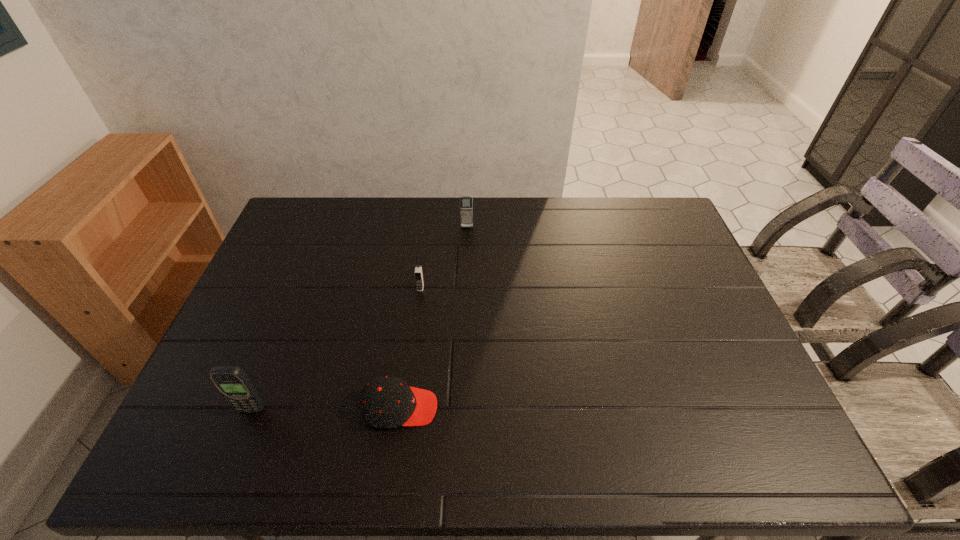
You are a GUI agent. You are given a task and a screenshot of the screen. Output one action in this format:
    pyautogui.click(x=<x>, y=<y>)
    Task: Click on the free space that is in between the leftmost object and the second nearest cellular telephone
    
    Given the screenshot: What is the action you would take?
    [336, 349]

Where is `blank region between the nearest cellular telephone and the shortest object`? The height and width of the screenshot is (540, 960). blank region between the nearest cellular telephone and the shortest object is located at coordinates (325, 408).

Where is `vacant area that lies between the nearest cellular telephone and the cap`? vacant area that lies between the nearest cellular telephone and the cap is located at coordinates (325, 408).

Image resolution: width=960 pixels, height=540 pixels. What are the coordinates of `free spot between the shortest object and the nearest cellular telephone` in the screenshot? It's located at point(325,408).

Locate an element on the screen. This screenshot has width=960, height=540. vacant area between the shortest object and the second cellular telephone from right to left is located at coordinates (410, 348).

What are the coordinates of `vacant space that is in between the rightmost object and the nearest cellular telephone` in the screenshot? It's located at (359, 319).

Where is `vacant area that lies between the rightmost cellular telephone and the second farthest cellular telephone`? The width and height of the screenshot is (960, 540). vacant area that lies between the rightmost cellular telephone and the second farthest cellular telephone is located at coordinates (444, 258).

You are a GUI agent. You are given a task and a screenshot of the screen. Output one action in this format:
    pyautogui.click(x=<x>, y=<y>)
    Task: Click on the vacant point located between the nearest cellular telephone and the rightmost cellular telephone
    
    Given the screenshot: What is the action you would take?
    pyautogui.click(x=359, y=319)

Image resolution: width=960 pixels, height=540 pixels. What are the coordinates of `free space between the third nearest object and the leftmost cellular telephone` in the screenshot? It's located at (336, 349).

Locate an element on the screen. vacant space in between the rightmost cellular telephone and the shortest object is located at coordinates (434, 318).